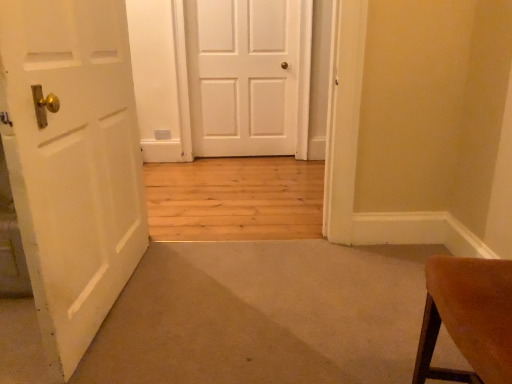
At what (x,y) coordinates should I click in order to perform the action: click on vacant space situated above white matte door at center, which is the 1th door from top to bottom (from a real-world perspective). Please return your answer as a coordinate pair (x, y). Looking at the image, I should click on (243, 0).